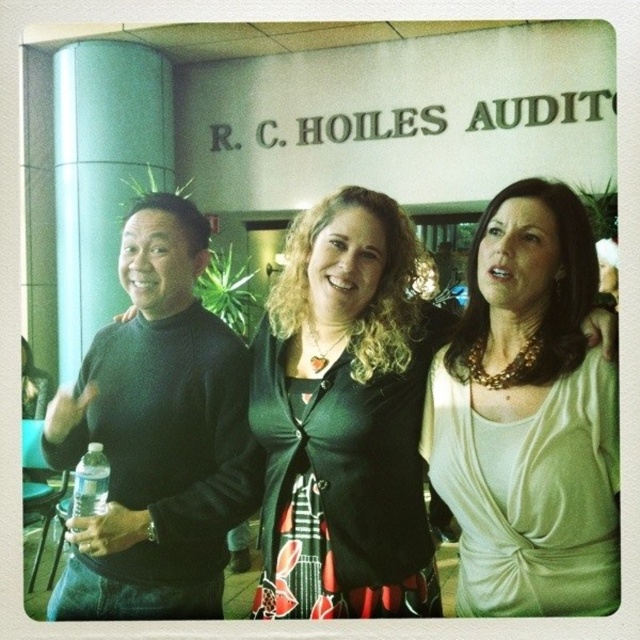
Can you confirm if white satin blouse at center is positioned above clear plastic bottle at lower left?

Yes, white satin blouse at center is above clear plastic bottle at lower left.

Between white satin blouse at center and clear plastic bottle at lower left, which one has more height?

white satin blouse at center is taller.

The height and width of the screenshot is (640, 640). What do you see at coordinates (529, 417) in the screenshot?
I see `white satin blouse at center` at bounding box center [529, 417].

Find the location of a particular element. white satin blouse at center is located at coordinates (529, 417).

Is the position of black matte cardigan at center more distant than that of black matte sweater at left?

That is False.

Does black matte cardigan at center have a lesser height compared to black matte sweater at left?

Correct, black matte cardigan at center is not as tall as black matte sweater at left.

Locate an element on the screen. The image size is (640, 640). black matte cardigan at center is located at coordinates (344, 419).

Does black matte cardigan at center have a greater width compared to clear plastic bottle at lower left?

Yes.

Is black matte cardigan at center to the left of clear plastic bottle at lower left from the viewer's perspective?

In fact, black matte cardigan at center is to the right of clear plastic bottle at lower left.

You are a GUI agent. You are given a task and a screenshot of the screen. Output one action in this format:
    pyautogui.click(x=<x>, y=<y>)
    Task: Click on the black matte cardigan at center
    The image size is (640, 640).
    Given the screenshot: What is the action you would take?
    pyautogui.click(x=344, y=419)

Locate an element on the screen. The height and width of the screenshot is (640, 640). black matte cardigan at center is located at coordinates (344, 419).